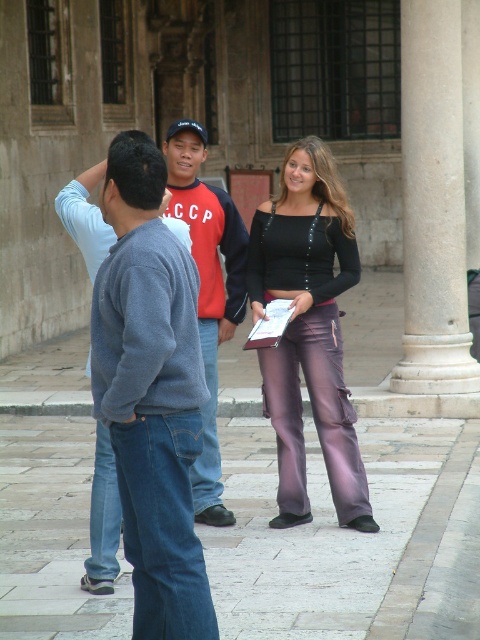
Question: From the image, what is the correct spatial relationship of denim jeans at left in relation to gray wool sweater at center?

Choices:
 (A) right
 (B) left

Answer: (B)

Question: Which point is farther to the camera?

Choices:
 (A) (229, 208)
 (B) (301, 284)

Answer: (A)

Question: Which of these objects is positioned closest to the metallic purple pants at center?

Choices:
 (A) red cotton shirt at center
 (B) black matte sweatshirt at center
 (C) denim jeans at left
 (D) gray wool sweater at center

Answer: (B)

Question: Is metallic purple pants at center to the left of gray wool sweater at center from the viewer's perspective?

Choices:
 (A) no
 (B) yes

Answer: (A)

Question: Which point appears farthest from the camera in this image?

Choices:
 (A) (324, 257)
 (B) (455, 150)
 (C) (190, 403)

Answer: (B)

Question: Can you confirm if white marble pillar at right is positioned to the right of purple satin pants at center?

Choices:
 (A) no
 (B) yes

Answer: (B)